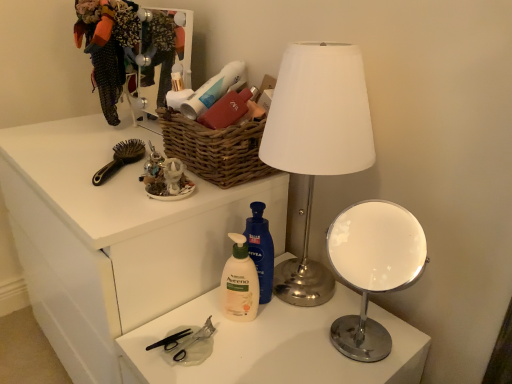
Locate an element on the screen. The width and height of the screenshot is (512, 384). vacant space that's between chrome/metallic table lamp at right and black plastic scissors at lower center is located at coordinates (284, 345).